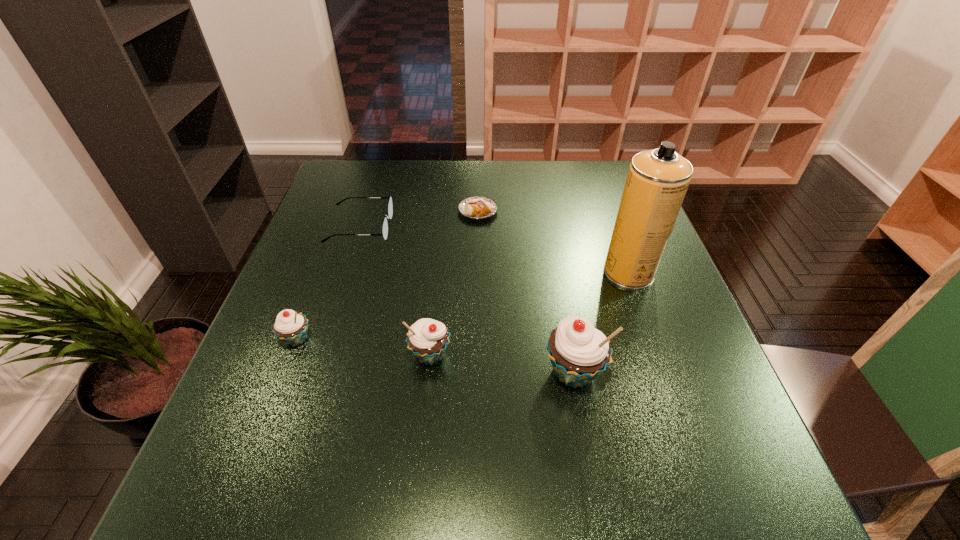
Locate an element on the screen. object that is at the right edge is located at coordinates (657, 181).

Locate an element on the screen. The height and width of the screenshot is (540, 960). vacant area at the far edge of the desktop is located at coordinates (415, 161).

I want to click on free space at the near edge, so click(523, 408).

In the image, there is a desktop. Where is `vacant space at the left edge`? This screenshot has width=960, height=540. vacant space at the left edge is located at coordinates (306, 232).

Identify the location of vacant space at the right edge of the desktop. The image size is (960, 540). (627, 333).

Where is `free space at the far left corner of the desktop`? The height and width of the screenshot is (540, 960). free space at the far left corner of the desktop is located at coordinates (353, 198).

This screenshot has height=540, width=960. I want to click on vacant region at the far right corner of the desktop, so click(597, 199).

The height and width of the screenshot is (540, 960). What are the coordinates of `vacant region between the rightmost object and the fifth tallest object` in the screenshot? It's located at (494, 249).

This screenshot has width=960, height=540. I want to click on free space between the rightmost cupcake and the shortest object, so click(x=525, y=292).

Locate an element on the screen. empty location between the aerosol can and the spectacles is located at coordinates (494, 249).